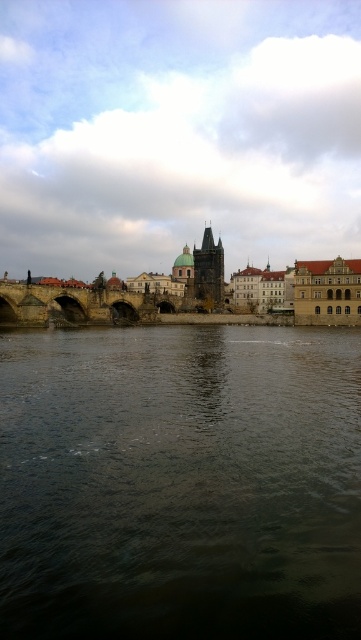
You are a drone operator trying to capture a photo of the dark brown water at center. According to the coordinates provided, where should you position the drone to get the best view?

The dark brown water at center is located at point (180, 483), so you should position the drone at those coordinates to capture the best view.

You are an architect analyzing the riverside cityscape. You observe the dark brown water at center and the stone bridge at center. Which object appears taller in the image?

The dark brown water at center appears taller than the stone bridge at center in the image.

You are standing on a hill overlooking the historic riverside cityscape. You notice the dark brown water at center and the stone bridge at center. Which object is positioned closer to your viewpoint?

The dark brown water at center is closer to the viewer than the stone bridge at center.